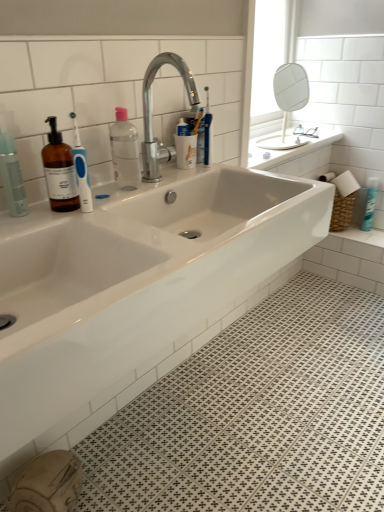
Where is `vacant space to the right of matte black spray can at left, which appears as the 2th toiletry when viewed from the right`? The height and width of the screenshot is (512, 384). vacant space to the right of matte black spray can at left, which appears as the 2th toiletry when viewed from the right is located at coordinates (87, 212).